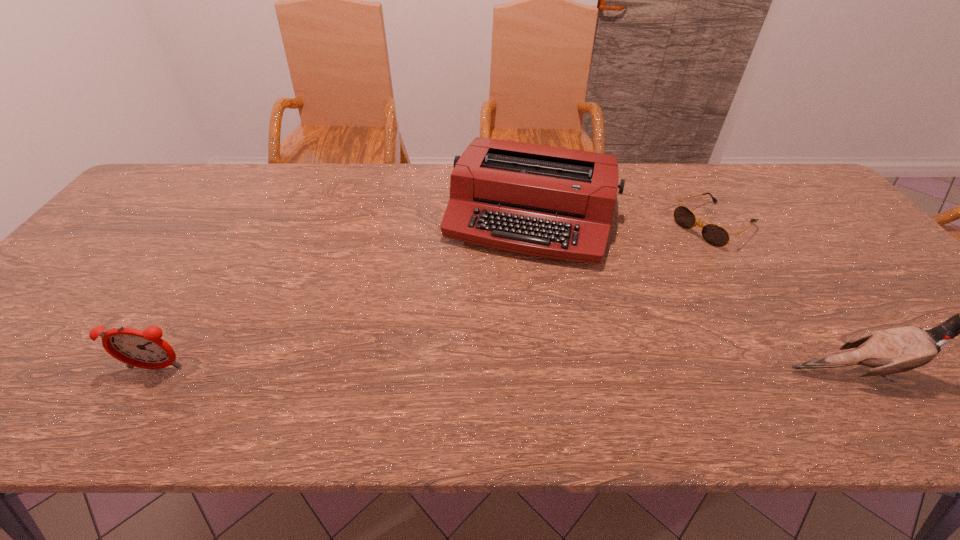
At what (x,y) coordinates should I click in order to perform the action: click on vacant spot on the desktop that is between the alarm clock and the tallest object and is positioned on the typing side of the third object from right to left. Please return your answer as a coordinate pair (x, y). Looking at the image, I should click on (481, 370).

In order to click on vacant spot on the desktop that is between the leftmost object and the tallest object and is positioned on the lenses of the shortest object in this screenshot , I will do `click(482, 370)`.